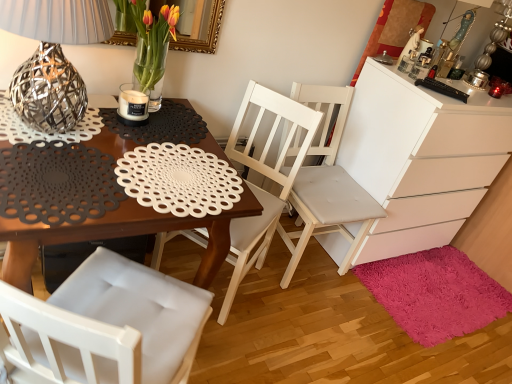
Question: Does white matte chest of drawers at right turn towards matte black placemat at center?

Choices:
 (A) yes
 (B) no

Answer: (B)

Question: Is white matte chest of drawers at right bigger than matte black placemat at center?

Choices:
 (A) no
 (B) yes

Answer: (B)

Question: From the image's perspective, is white matte chest of drawers at right on matte black placemat at center?

Choices:
 (A) yes
 (B) no

Answer: (A)

Question: Is white matte chest of drawers at right oriented away from matte black placemat at center?

Choices:
 (A) no
 (B) yes

Answer: (A)

Question: Is white matte chest of drawers at right wider than matte black placemat at center?

Choices:
 (A) yes
 (B) no

Answer: (B)

Question: Does point (158, 107) appear closer or farther from the camera than point (260, 211)?

Choices:
 (A) closer
 (B) farther

Answer: (A)

Question: From a real-world perspective, is matte glass vase with tulips at upper center positioned above or below matte black placemat at center?

Choices:
 (A) above
 (B) below

Answer: (A)

Question: Based on their sizes in the image, would you say matte glass vase with tulips at upper center is bigger or smaller than matte black placemat at center?

Choices:
 (A) big
 (B) small

Answer: (B)

Question: Which is correct: matte glass vase with tulips at upper center is inside matte black placemat at center, or outside of it?

Choices:
 (A) outside
 (B) inside

Answer: (A)

Question: From a real-world perspective, is white matte chest of drawers at right physically located above or below metallic wire ball at left?

Choices:
 (A) above
 (B) below

Answer: (B)

Question: Looking at their shapes, would you say white matte chest of drawers at right is wider or thinner than metallic wire ball at left?

Choices:
 (A) thin
 (B) wide

Answer: (B)

Question: From the image's perspective, is white matte chest of drawers at right positioned above or below metallic wire ball at left?

Choices:
 (A) below
 (B) above

Answer: (A)

Question: Would you say white matte chest of drawers at right is to the left or to the right of metallic wire ball at left in the picture?

Choices:
 (A) left
 (B) right

Answer: (B)

Question: Based on their sizes in the image, would you say shaggy pink rug at lower right is bigger or smaller than white matte chest of drawers at right?

Choices:
 (A) big
 (B) small

Answer: (B)

Question: From the image's perspective, relative to white matte chest of drawers at right, is shaggy pink rug at lower right above or below?

Choices:
 (A) above
 (B) below

Answer: (B)